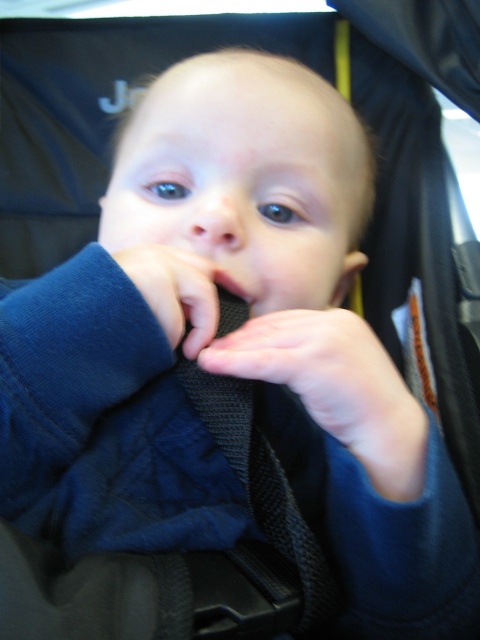
You are a photographer setting up a photo shoot for a baby in a stroller. You notice the dark blue fabric at center and the matte black mouth at center. Which object in the scene takes up more visual space?

The dark blue fabric at center is bigger than the matte black mouth at center, so the dark blue fabric at center takes up more visual space.

You are a photographer setting up a photo shoot for a baby in a stroller. You notice the dark blue fabric at center and the matte black mouth at center. Which object is positioned higher in the frame?

The dark blue fabric at center is taller than the matte black mouth at center, so the dark blue fabric at center is positioned higher in the frame.